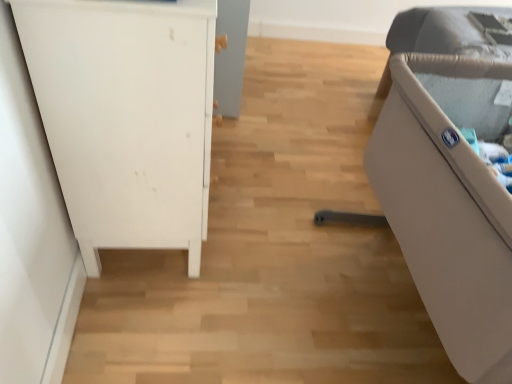
You are a GUI agent. You are given a task and a screenshot of the screen. Output one action in this format:
    pyautogui.click(x=<x>, y=<y>)
    Task: Click on the free location to the left of beige plastic crib at right, the second furniture from the left
    The image size is (512, 384).
    Given the screenshot: What is the action you would take?
    pyautogui.click(x=248, y=279)